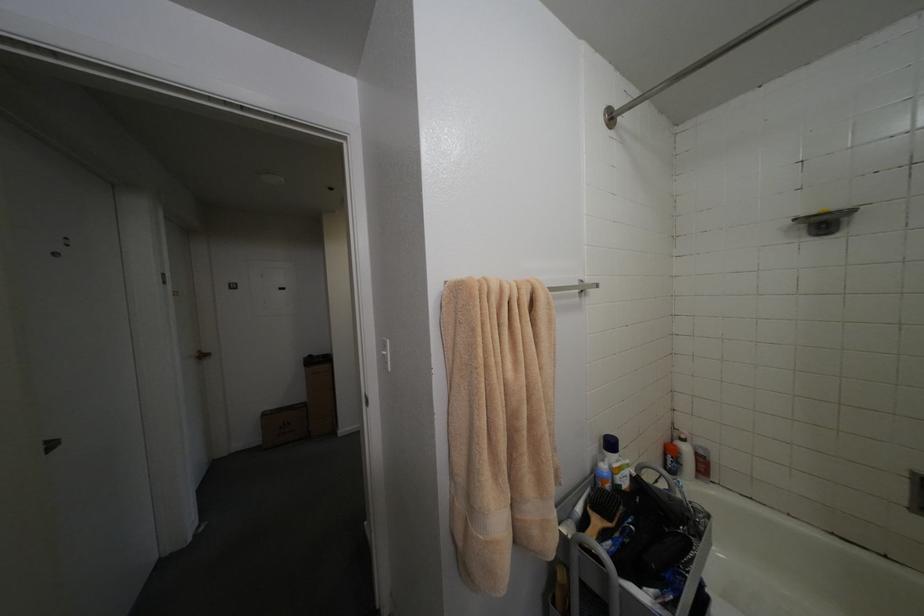
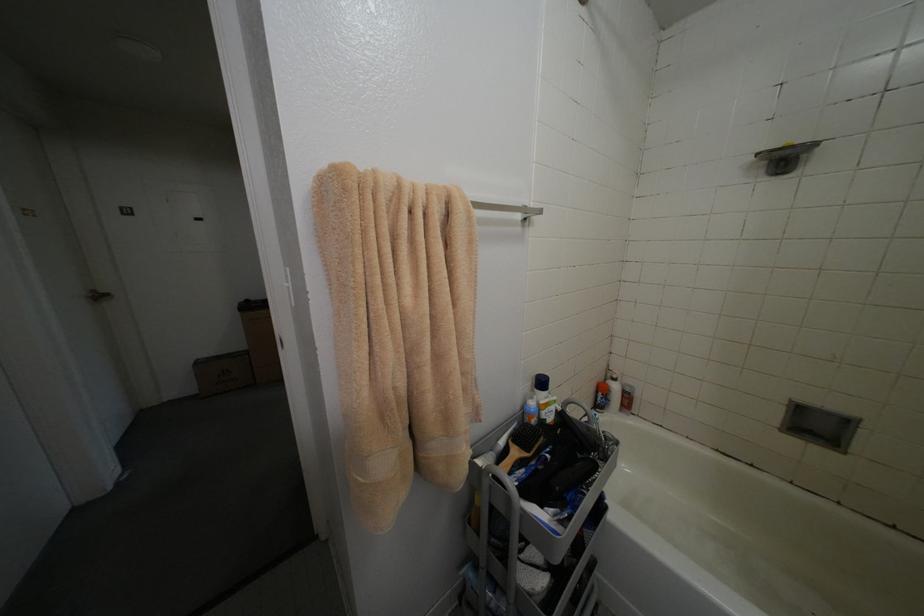
Looking at this image, what movement of the cameraman would produce the second image?

The cameraman moved toward right, forward.